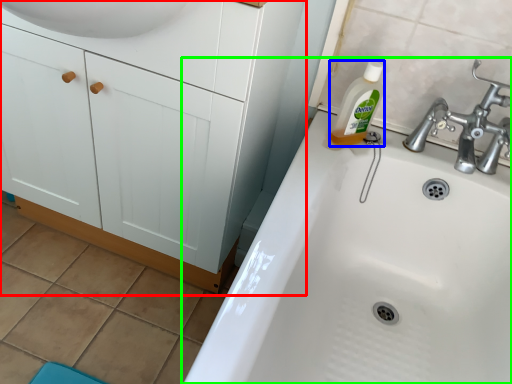
Question: Which object is the closest to the bathroom cabinet (highlighted by a red box)? Choose among these: cleaning product (highlighted by a blue box) or sink (highlighted by a green box).

Choices:
 (A) cleaning product
 (B) sink

Answer: (B)